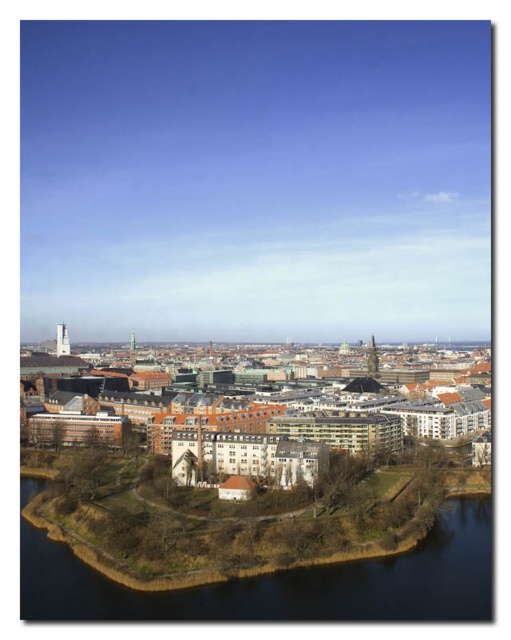
Question: Is brown brick buildings at center smaller than dark blue water at lower left?

Choices:
 (A) no
 (B) yes

Answer: (A)

Question: Where is brown brick buildings at center located in relation to dark blue water at lower left in the image?

Choices:
 (A) left
 (B) right

Answer: (B)

Question: Which point is closer to the camera?

Choices:
 (A) brown brick buildings at center
 (B) dark blue water at lower left

Answer: (B)

Question: Can you confirm if brown brick buildings at center is smaller than dark blue water at lower left?

Choices:
 (A) no
 (B) yes

Answer: (A)